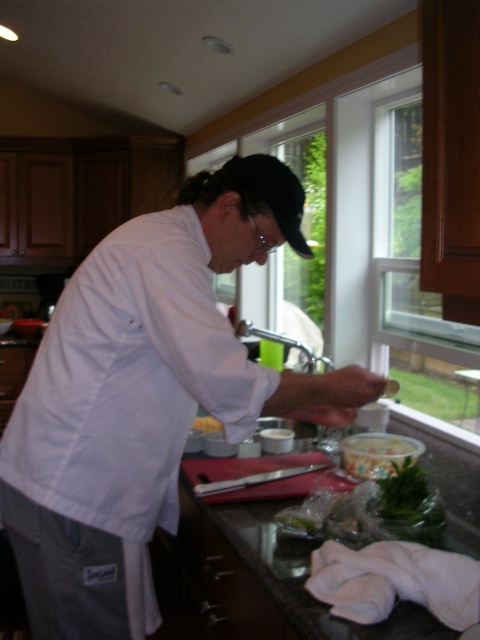
You are a kitchen assistant who needs to place a new spice jar between the white fabric chef at center and the smooth plastic container at lower center. Which object should you place the spice jar closer to if you want it to be closer to the taller object?

The white fabric chef at center is taller than the smooth plastic container at lower center. Therefore, to place the spice jar closer to the taller object, you should position it nearer to the white fabric chef at center.

You are a chef preparing a dish and need to place a large bowl on the smooth granite countertop at center and the yellow matte butter at center. Which surface can accommodate the large bowl more comfortably?

The smooth granite countertop at center is bigger than the yellow matte butter at center, so the large bowl can be placed more comfortably on the smooth granite countertop at center.

You are a kitchen assistant who needs to retrieve the smooth plastic container at lower center. The chef is currently standing at the white fabric chef at center. Can you walk directly behind the chef to reach the container?

The white fabric chef at center is located above the smooth plastic container at lower center, so you can walk directly behind the chef to reach the container since it is positioned below the chef.